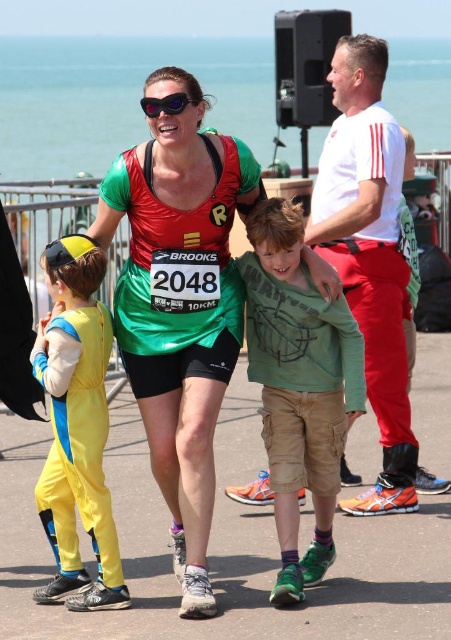
Based on the scene description, can you determine the position of the green cotton shirt at center relative to the purple reflective sunglasses at center?

The green cotton shirt at center is positioned to the right of the purple reflective sunglasses at center.

You are a photographer at the race event. You want to take a photo of the participant wearing the matte green tank top at center and the purple reflective sunglasses at center. Which object should you focus on first if you want to capture both clearly in the frame?

The matte green tank top at center is bigger than the purple reflective sunglasses at center, so you should focus on the matte green tank top at center first to ensure it is in clear focus before adjusting for the smaller sunglasses.